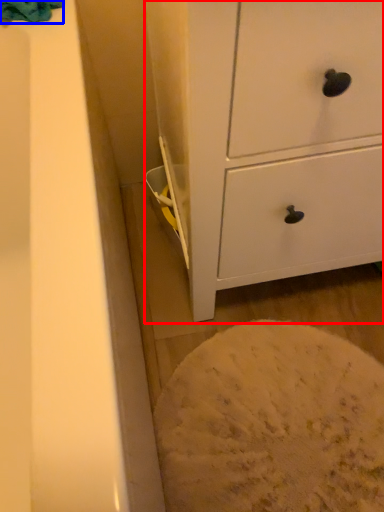
Question: Which object appears farthest to the camera in this image, chest of drawers (highlighted by a red box) or bath towel (highlighted by a blue box)?

Choices:
 (A) chest of drawers
 (B) bath towel

Answer: (B)